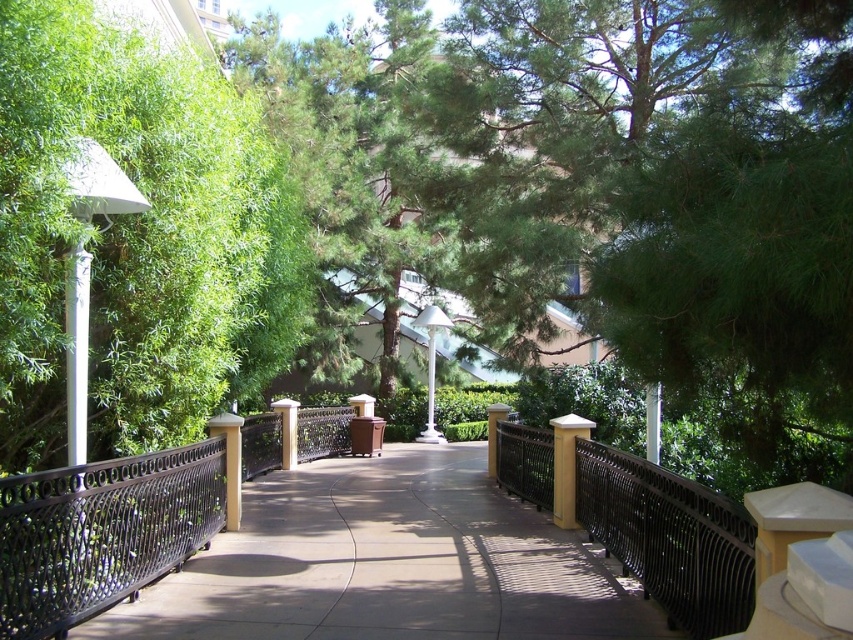
You are standing at the entrance of the garden and want to reach the building ahead. The black wrought iron fence at center is in your way. Can you walk around it? Please explain your reasoning based on its position.

The black wrought iron fence at center is located at coordinates point (669,538). Since the path curves gently through the frame and leads towards the building, it is likely that the fence is part of the pathway border and not blocking the path itself. Therefore, you can walk around it by following the curved path towards the building.

You are a delivery person trying to navigate through the garden path. You need to pass between the black wrought iron fence at center and the matte white pillar at center. Can you fit through the space between them if your delivery cart is 1.2 meters wide?

The black wrought iron fence at center is thinner than the matte white pillar at center, but the description does not provide exact measurements of the space between them. Therefore, it is uncertain whether the delivery cart can fit through the space.